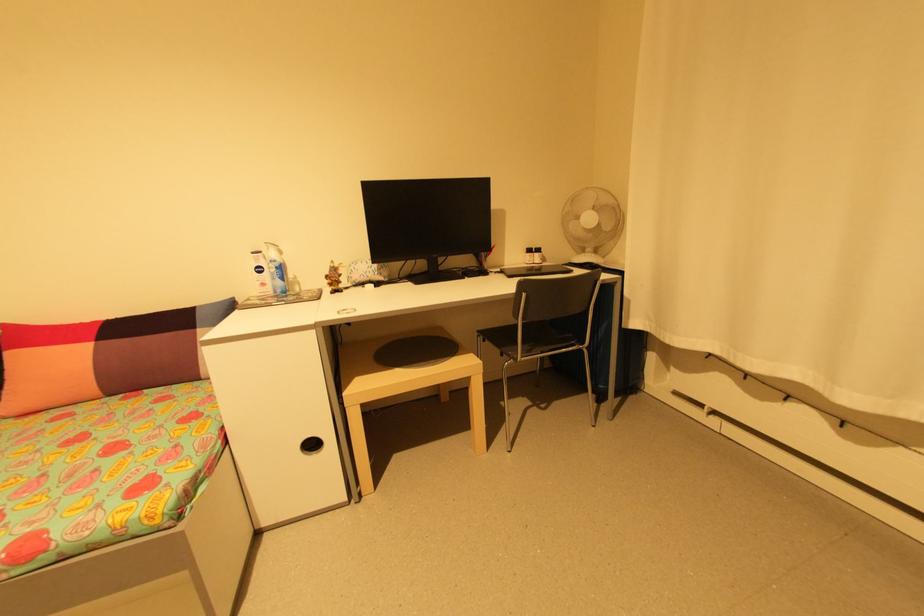
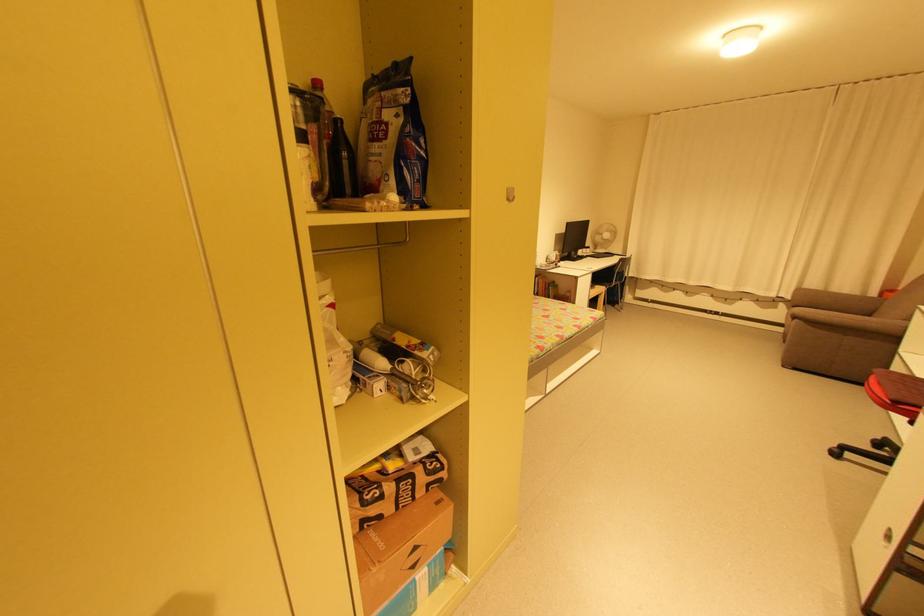
Where in the second image is the point corresponding to (541,254) from the first image?

(592, 249)